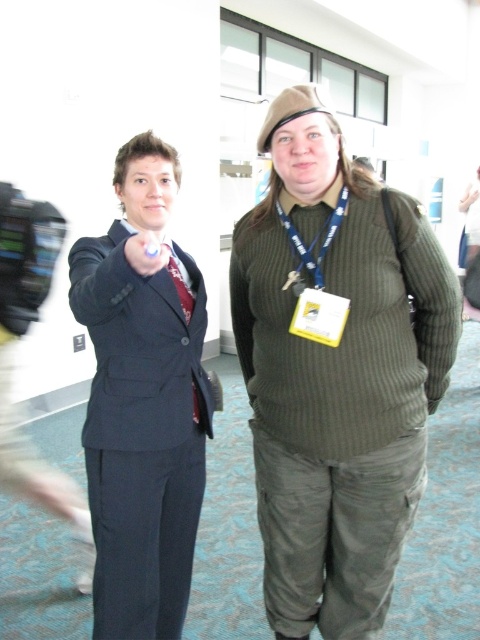
Question: Is matte black suit at center to the left of green fabric neck at center from the viewer's perspective?

Choices:
 (A) no
 (B) yes

Answer: (B)

Question: Which of the following is the farthest from the observer?

Choices:
 (A) (301, 452)
 (B) (177, 189)
 (C) (334, 204)
 (D) (279, 220)

Answer: (B)

Question: Is matte black suit at center further to camera compared to blue fabric lanyard at center?

Choices:
 (A) no
 (B) yes

Answer: (A)

Question: Which point is closer to the camera taking this photo?

Choices:
 (A) (321, 189)
 (B) (96, 378)

Answer: (A)

Question: Estimate the real-world distances between objects in this image. Which object is closer to the blue fabric lanyard at center?

Choices:
 (A) matte black suit at left
 (B) matte black suit at center
 (C) green fabric neck at center

Answer: (C)

Question: Does matte black suit at left have a smaller size compared to matte black suit at center?

Choices:
 (A) yes
 (B) no

Answer: (B)